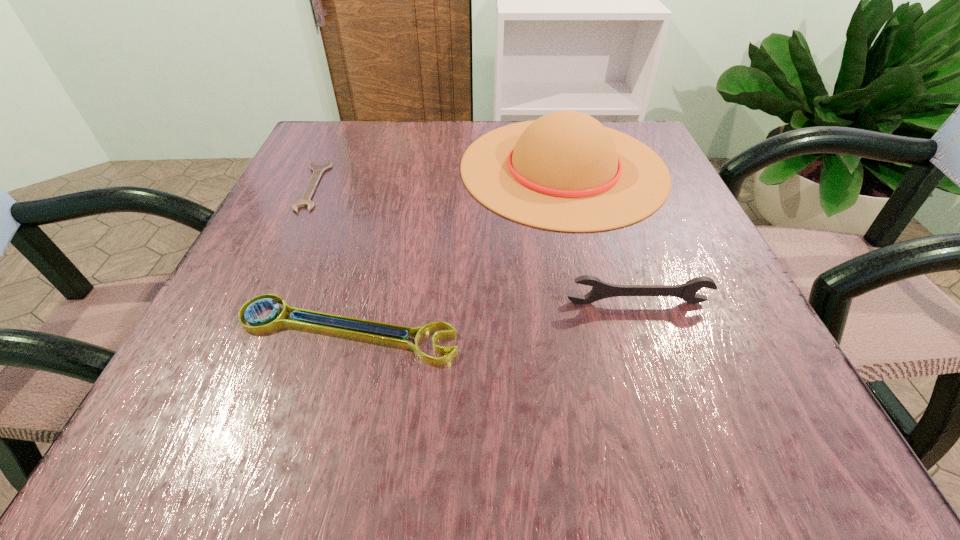
The width and height of the screenshot is (960, 540). In order to click on blank region between the shortest wrench and the tallest wrench in this screenshot , I will do `click(474, 244)`.

The width and height of the screenshot is (960, 540). I want to click on vacant area between the second tallest object and the sombrero, so click(600, 235).

Where is `empty space that is in between the second tallest wrench and the shortest object`? The height and width of the screenshot is (540, 960). empty space that is in between the second tallest wrench and the shortest object is located at coordinates (330, 258).

This screenshot has height=540, width=960. I want to click on vacant point located between the rightmost wrench and the tallest object, so click(x=600, y=235).

What are the coordinates of `vacant space in between the sombrero and the farthest wrench` in the screenshot? It's located at (438, 177).

The image size is (960, 540). What are the coordinates of `free spot between the farthest wrench and the tallest object` in the screenshot? It's located at (438, 177).

Identify the location of free space between the third tallest object and the sombrero. click(455, 249).

Identify the location of empty space that is in between the second shortest wrench and the tallest wrench. The height and width of the screenshot is (540, 960). click(492, 316).

What are the coordinates of `empty space between the second shortest wrench and the tallest wrench` in the screenshot? It's located at (492, 316).

Identify the location of vacant area between the third shortest object and the second shortest wrench. The width and height of the screenshot is (960, 540). (492, 316).